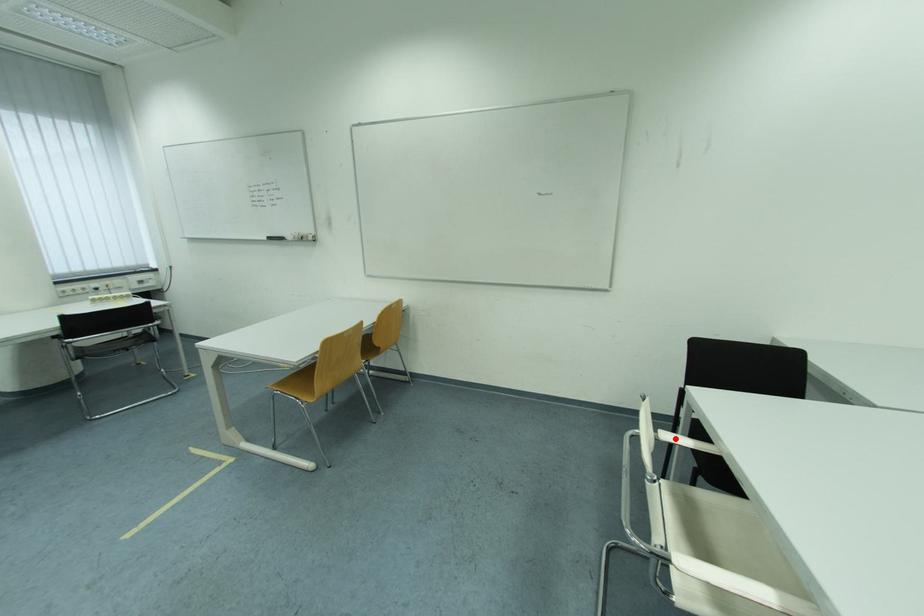
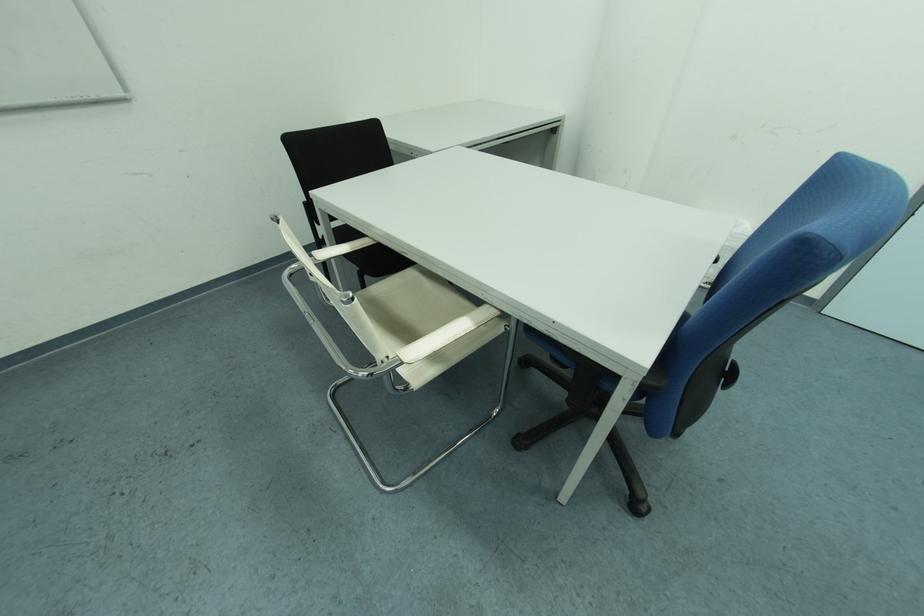
Find the pixel in the second image that matches the highlighted location in the first image.

(331, 257)